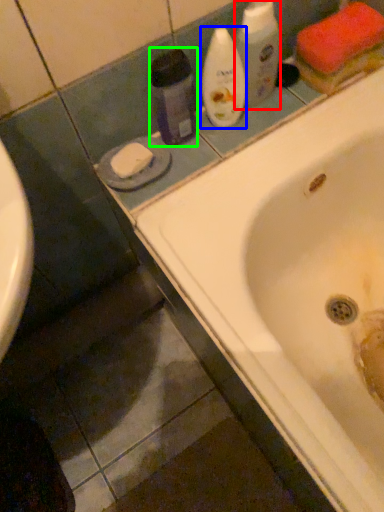
Question: Estimate the real-world distances between objects in this image. Which object is closer to cleaning product (highlighted by a red box), cleaning product (highlighted by a blue box) or cleaning product (highlighted by a green box)?

Choices:
 (A) cleaning product
 (B) cleaning product

Answer: (A)